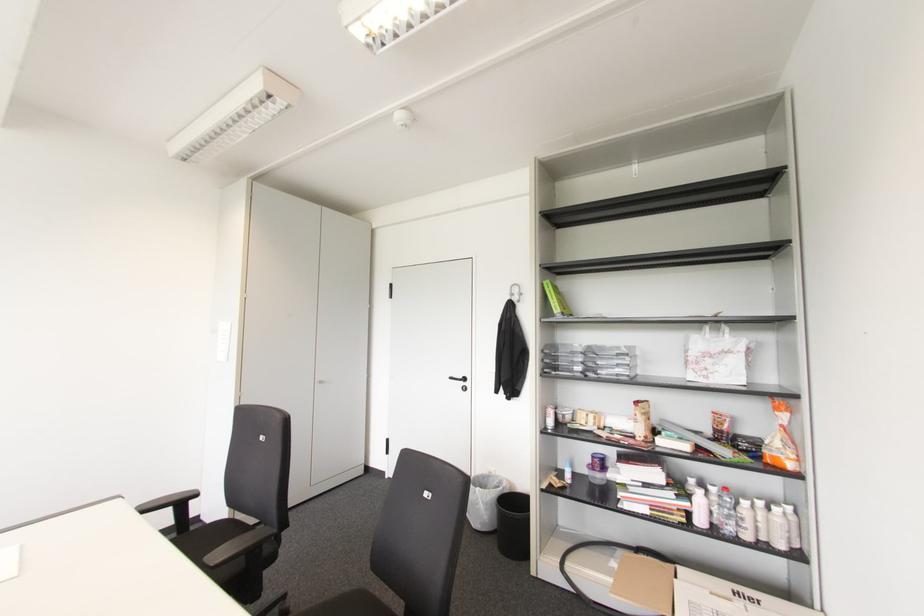
The width and height of the screenshot is (924, 616). Describe the element at coordinates (515, 293) in the screenshot. I see `the metal wall hook` at that location.